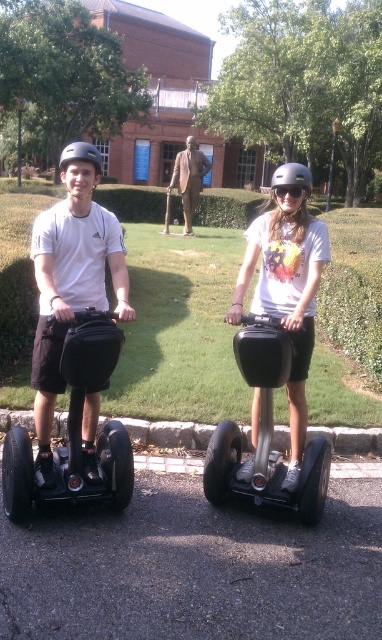
You are a photographer trying to capture a clear photo of both the matte white helmet at center and the matte black helmet at center. Since you want to ensure both are visible, which helmet should you focus on first if you want to frame them properly?

The matte white helmet at center is positioned on the left side of matte black helmet at center, so you should focus on the matte white helmet at center first to frame them properly.

You are planning to take a photo of the matte white helmet at center and the brown polished wood statue at center. Which object should you focus on first if you want to capture both in a single frame without moving the camera?

The matte white helmet at center is smaller than the brown polished wood statue at center, so you should focus on the brown polished wood statue at center first to ensure both are in focus.

You are a tour guide leading a group in the park. You notice two Segway riders with helmets. The riders are positioned such that their helmets are both at the center of your view. The matte white helmet at center and the matte black helmet at center are part of your group. If your Segway has a turning radius of 10 feet, can you safely maneuver between them to address a question from one rider without hitting either helmet?

The matte white helmet at center is 30.87 feet from the matte black helmet at center. Since the distance between them is greater than twice the Segway turning radius of 10 feet, you can safely maneuver between them without hitting either helmet.